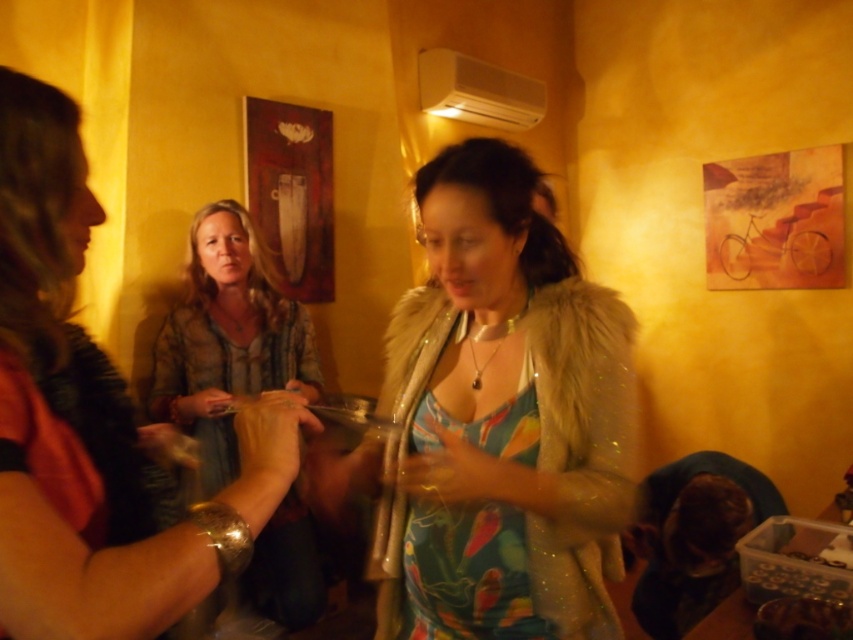
Question: Which point is farther to the camera?

Choices:
 (A) (213, 278)
 (B) (144, 572)
 (C) (519, 620)

Answer: (A)

Question: Which point appears farthest from the camera in this image?

Choices:
 (A) 492,525
 (B) 33,230
 (C) 254,369

Answer: (C)

Question: Is matte brown shirt at center in front of floral fabric dress at center?

Choices:
 (A) yes
 (B) no

Answer: (A)

Question: Is fuzzy fur coat at center thinner than matte brown shirt at center?

Choices:
 (A) no
 (B) yes

Answer: (A)

Question: Which object is farther from the camera taking this photo?

Choices:
 (A) floral fabric dress at center
 (B) matte brown shirt at center
 (C) fuzzy fur coat at center

Answer: (A)

Question: Can you confirm if fuzzy fur coat at center is thinner than rustic brown shirt at center?

Choices:
 (A) no
 (B) yes

Answer: (B)